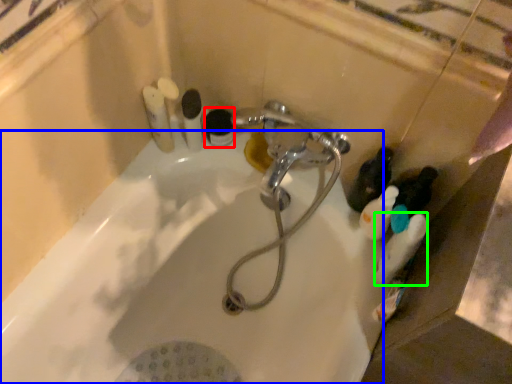
Question: Based on their relative distances, which object is nearer to toiletry (highlighted by a red box)? Choose from bath (highlighted by a blue box) and cleaning product (highlighted by a green box).

Choices:
 (A) bath
 (B) cleaning product

Answer: (A)